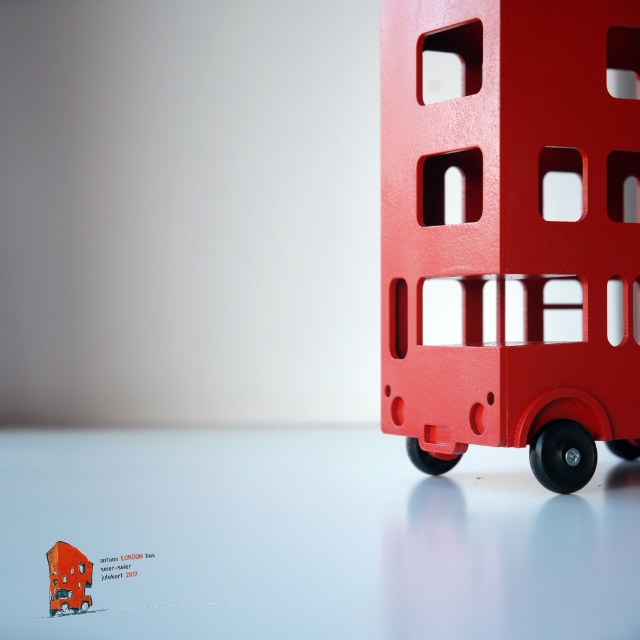
Can you confirm if matte plastic bus at right is smaller than matte red bus at center?

Incorrect, matte plastic bus at right is not smaller in size than matte red bus at center.

Can you confirm if matte plastic bus at right is taller than matte red bus at center?

Correct, matte plastic bus at right is much taller as matte red bus at center.

Is point (513, 90) farther from camera compared to point (65, 593)?

Yes, it is.

Where is `matte plastic bus at right`? matte plastic bus at right is located at coordinates (512, 230).